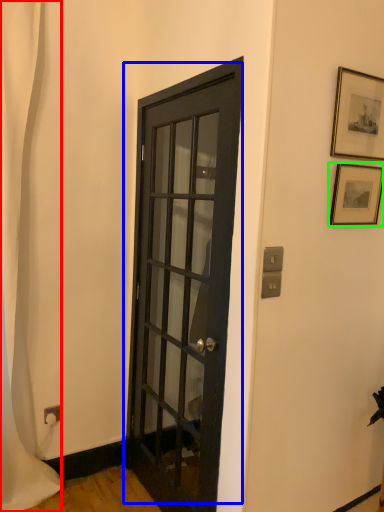
Question: Estimate the real-world distances between objects in this image. Which object is closer to shower curtain (highlighted by a red box), door (highlighted by a blue box) or picture frame (highlighted by a green box)?

Choices:
 (A) door
 (B) picture frame

Answer: (A)